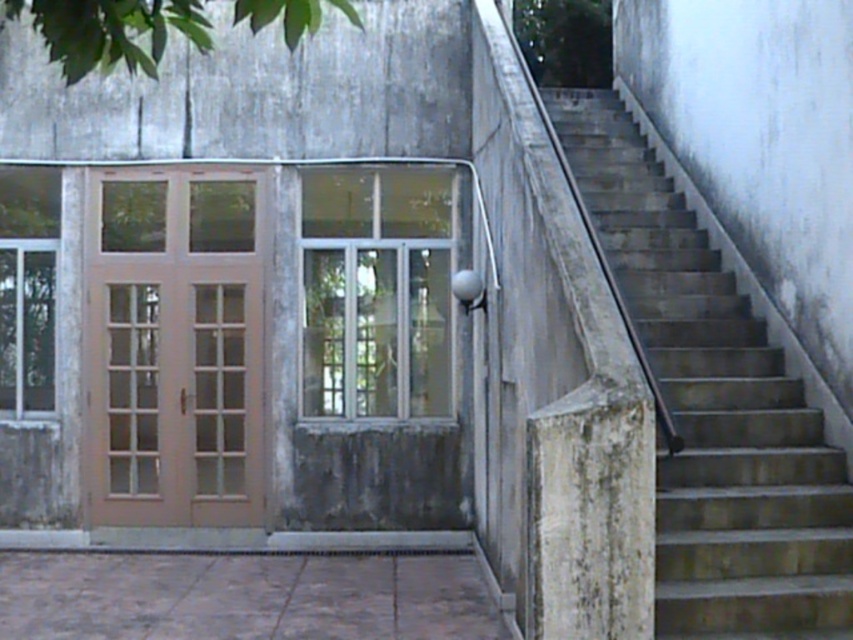
Is point (746, 356) positioned after point (196, 232)?

No, (746, 356) is closer to viewer.

Is concrete stairs at right smaller than light brown wood door at left?

Correct, concrete stairs at right occupies less space than light brown wood door at left.

Does point (717, 257) lie in front of point (239, 243)?

Yes, it is in front of point (239, 243).

Find the location of a particular element. The height and width of the screenshot is (640, 853). concrete stairs at right is located at coordinates 712,410.